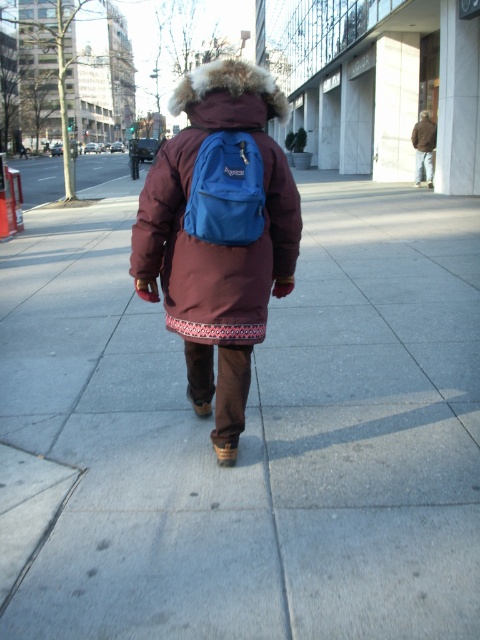
Is point (424, 252) less distant than point (228, 227)?

No, (424, 252) is behind (228, 227).

Find the location of a particular element. The image size is (480, 640). gray concrete sidewalk at center is located at coordinates click(245, 433).

Between point (172, 500) and point (240, 122), which one is positioned behind?

The point (172, 500) is more distant.

Does point (204, 576) come in front of point (164, 272)?

Yes, it is.

Identify the location of gray concrete sidewalk at center. This screenshot has height=640, width=480. (245, 433).

Locate an element on the screen. gray concrete sidewalk at center is located at coordinates (245, 433).

Is maroon fur-lined coat at center taller than matte blue backpack at center?

Indeed, maroon fur-lined coat at center has a greater height compared to matte blue backpack at center.

Does maroon fur-lined coat at center have a larger size compared to matte blue backpack at center?

Yes.

Is point (268, 273) positioned behind point (231, 136)?

Yes, point (268, 273) is behind point (231, 136).

Find the location of a particular element. The width and height of the screenshot is (480, 640). maroon fur-lined coat at center is located at coordinates click(x=214, y=243).